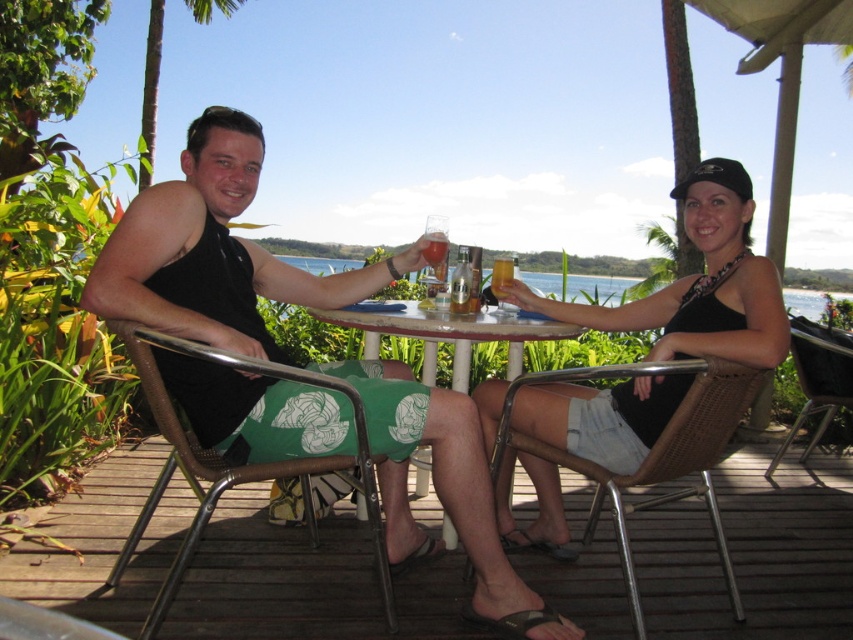
From the picture: You are a delivery robot with a 1.2 meter arm reach. You need to place a package on the wooden deck at lower center from your current position near the translucent glass at table center. Can your arm reach the deck?

The distance between the wooden deck at lower center and the translucent glass at table center is 1.28 meters. Since your arm can only reach 1.2 meters, you cannot reach the deck from the glass.

You are planning to place a large potted plant on the wooden deck at lower center. Considering the space occupied by the clear water at table center, will there be enough room for the plant?

The wooden deck at lower center might be wider than clear water at table center, so there might be enough space for the plant.

Based on the photo, you are planning to place a small potted plant on the wooden deck at lower center. Considering the clear water at table center is nearby, where should you place the plant to avoid it falling into the water?

You should place the small potted plant on the wooden deck at lower center away from the edge closest to the clear water at table center to prevent it from falling in.